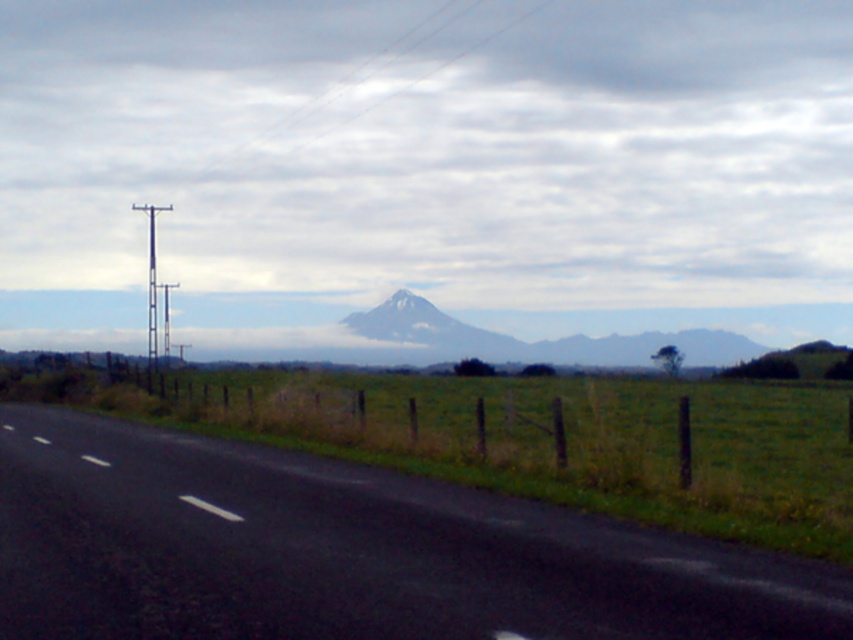
You are a hiker standing on the black asphalt road at center, looking towards the cloudy sky at upper center. Which object is higher from the ground?

The cloudy sky at upper center is taller than the black asphalt road at center, so the cloudy sky at upper center is higher from the ground.

You are a drone operator planning to fly a drone with a 1.2 meter wingspan. The drone must stay below the cloudy sky at upper center and above the black asphalt road at center. Can the drone safely navigate between these two features?

The cloudy sky at upper center might be wider than the black asphalt road at center. Since the sky is wider, there should be enough space for the drone with a 1.2 meter wingspan to navigate safely between them.